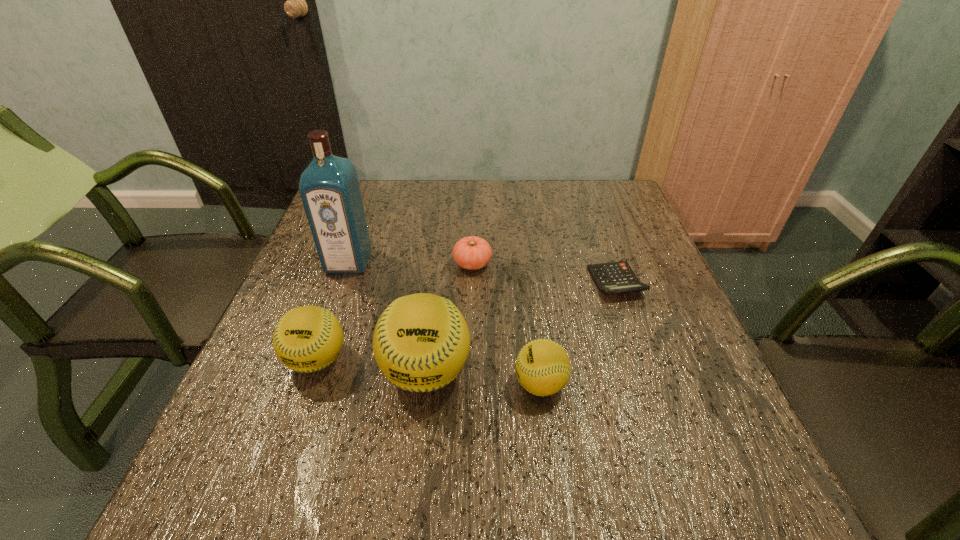
Observe the arrangement of all softballs in the image. To keep them evenly spaced, where would you place another softball on the right? Please locate a free space. Please provide its 2D coordinates. Your answer should be formatted as a tuple, i.e. [(x, y)], where the tuple contains the x and y coordinates of a point satisfying the conditions above.

[(661, 397)]